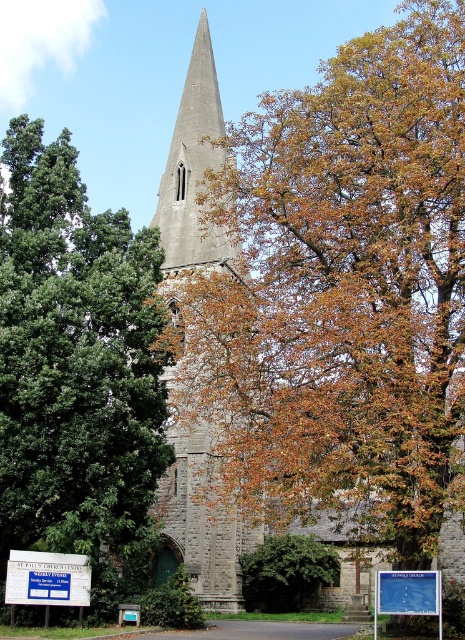
Question: Which point is farther to the camera?

Choices:
 (A) blue plastic sign at lower left
 (B) brown leafy tree at center
 (C) green leafy tree at left
 (D) gray stone tower at center

Answer: (D)

Question: Is green leafy tree at left bigger than gray stone tower at center?

Choices:
 (A) yes
 (B) no

Answer: (B)

Question: Which of the following is the closest to the observer?

Choices:
 (A) green leafy tree at left
 (B) blue plastic sign at lower center

Answer: (B)

Question: Which is nearer to the brown textured tree at center?

Choices:
 (A) gray stone tower at center
 (B) blue plastic sign at lower left

Answer: (A)

Question: Can you confirm if gray stone tower at center is thinner than blue plastic sign at lower center?

Choices:
 (A) no
 (B) yes

Answer: (A)

Question: Is brown textured tree at center above blue plastic sign at lower left?

Choices:
 (A) yes
 (B) no

Answer: (B)